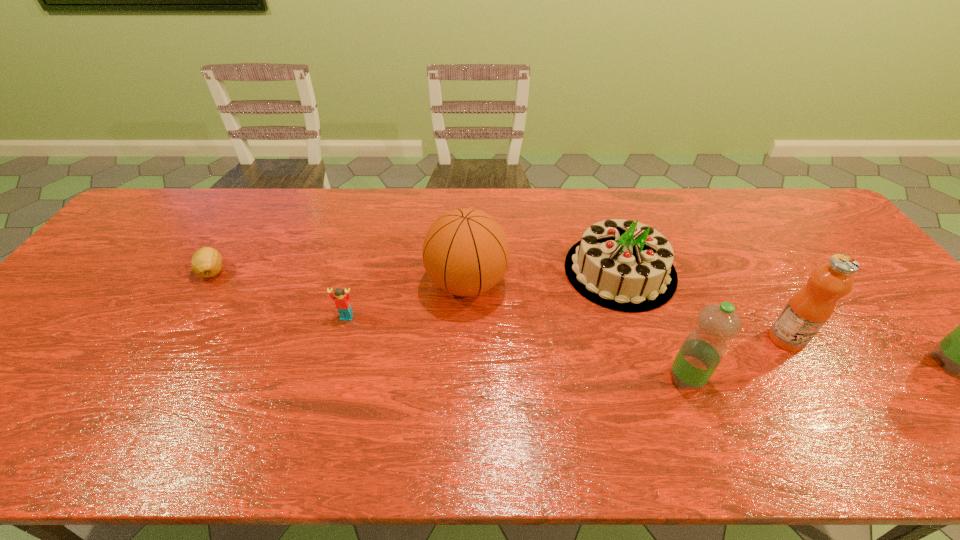
Find the location of `vacant area located on the right of the fifth object from right to left`. vacant area located on the right of the fifth object from right to left is located at coordinates (594, 283).

Find the location of a particular element. This screenshot has height=540, width=960. vacant space located 0.240m on the left of the birthday cake is located at coordinates (481, 271).

At what (x,y) coordinates should I click in order to perform the action: click on free space located 0.290m on the right of the fruit juice. Please return your answer as a coordinate pair (x, y). The height and width of the screenshot is (540, 960). Looking at the image, I should click on (921, 339).

Image resolution: width=960 pixels, height=540 pixels. Find the location of `free space located on the face of the Lego`. free space located on the face of the Lego is located at coordinates (326, 390).

Identify the location of object that is at the near edge. (703, 349).

The width and height of the screenshot is (960, 540). In the image, there is a desktop. In order to click on vacant space at the far edge in this screenshot , I will do `click(647, 191)`.

In the image, there is a desktop. Identify the location of vacant space at the left edge. (119, 277).

The height and width of the screenshot is (540, 960). What are the coordinates of `vacant space at the far left corner` in the screenshot? It's located at (161, 198).

Locate an element on the screen. free space at the near left corner of the desktop is located at coordinates (31, 402).

Image resolution: width=960 pixels, height=540 pixels. What are the coordinates of `free space at the far right corner` in the screenshot? It's located at (820, 228).